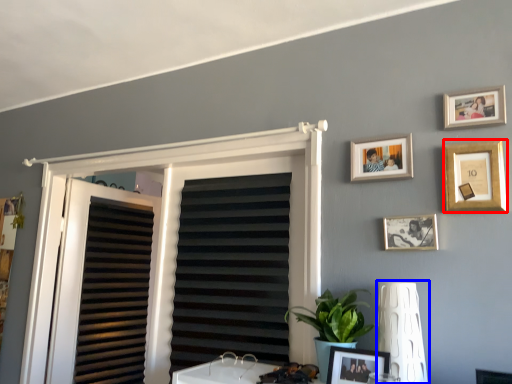
Question: Which point is further to the camera, picture frame (highlighted by a red box) or lamp (highlighted by a blue box)?

Choices:
 (A) picture frame
 (B) lamp

Answer: (A)